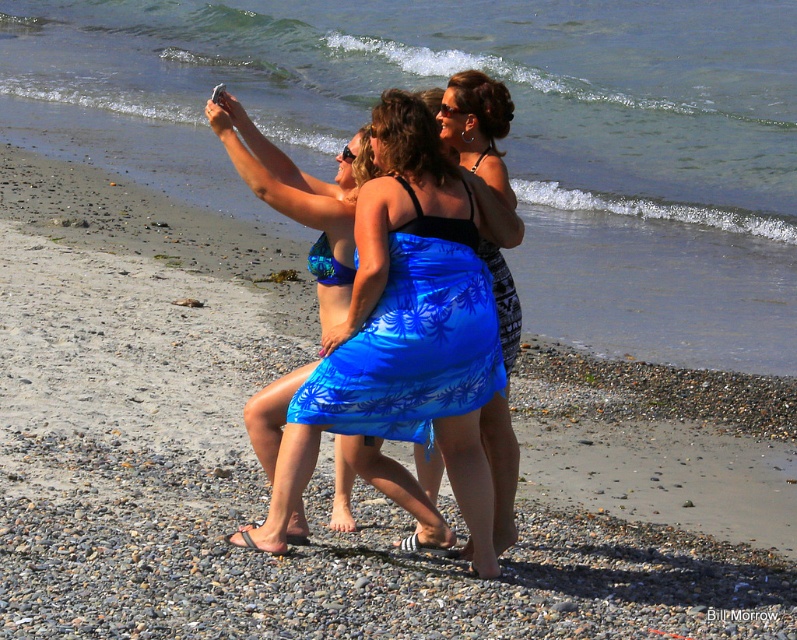
Is shiny blue sarong at center above blue fabric skirt at center?

No.

Is point (415, 307) closer to viewer compared to point (489, 157)?

Yes, point (415, 307) is in front of point (489, 157).

Who is more forward, (474,387) or (446,113)?

Point (474,387)

The width and height of the screenshot is (797, 640). What are the coordinates of `shiny blue sarong at center` in the screenshot? It's located at (411, 340).

Is shiny blue sarong at center thinner than blue fabric sarong at center?

In fact, shiny blue sarong at center might be wider than blue fabric sarong at center.

Which of these two, shiny blue sarong at center or blue fabric sarong at center, stands shorter?

shiny blue sarong at center

Is point (470, 360) less distant than point (391, 468)?

Yes, point (470, 360) is closer to viewer.

This screenshot has width=797, height=640. What are the coordinates of `shiny blue sarong at center` in the screenshot? It's located at (411, 340).

Who is more distant from viewer, (340, 236) or (511, 202)?

The point (511, 202) is more distant.

Is blue fabric sarong at center positioned in front of blue fabric skirt at center?

No, blue fabric sarong at center is behind blue fabric skirt at center.

Which is in front, point (419, 508) or point (458, 74)?

Point (419, 508)

The height and width of the screenshot is (640, 797). I want to click on blue fabric sarong at center, so click(300, 198).